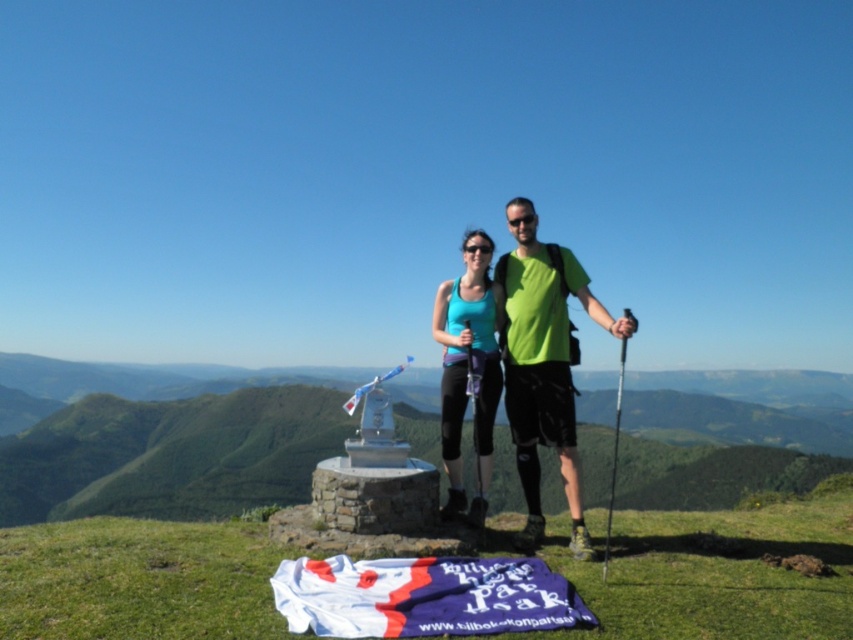
Question: Which point is closer to the camera taking this photo?

Choices:
 (A) (525, 605)
 (B) (485, 458)

Answer: (A)

Question: Where is green matte tank top at center located in relation to teal fabric tank top at center in the image?

Choices:
 (A) left
 (B) right

Answer: (B)

Question: Is white fabric flag at lower center positioned before green matte tank top at center?

Choices:
 (A) yes
 (B) no

Answer: (A)

Question: Among these points, which one is farthest from the camera?

Choices:
 (A) (456, 595)
 (B) (558, 307)
 (C) (489, 330)

Answer: (C)

Question: Does green matte tank top at center lie behind teal fabric tank top at center?

Choices:
 (A) no
 (B) yes

Answer: (A)

Question: Which point appears closest to the camera in this image?

Choices:
 (A) (560, 595)
 (B) (532, 531)

Answer: (A)